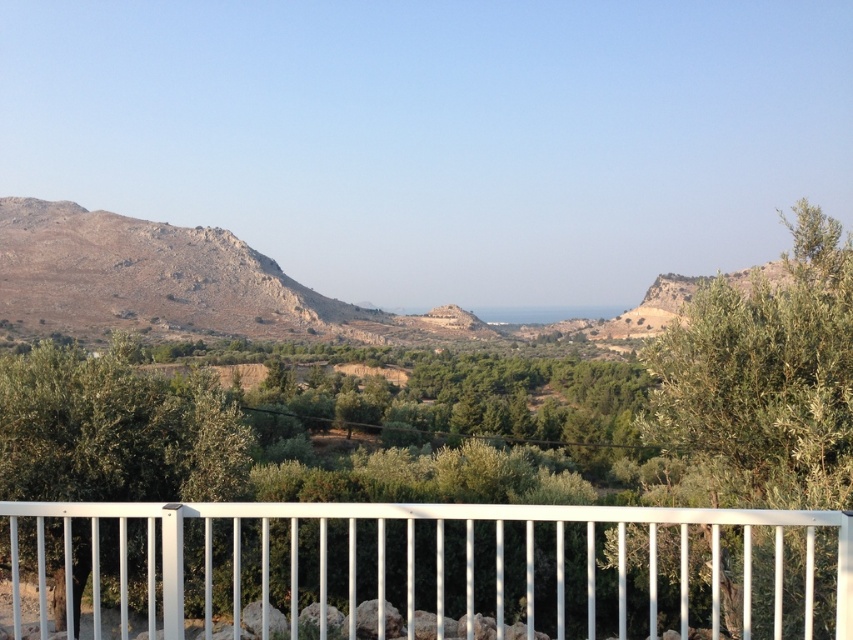
You are standing on a balcony with a white metal railing and looking out at the landscape. You notice a green leafy tree at right and a brown rocky mountain at center. Which object appears taller in the scene?

The green leafy tree at right has a lesser height compared to the brown rocky mountain at center, so the brown rocky mountain at center appears taller.

You are standing on a balcony and notice the white metal railing at lower center and the brown rocky mountain at center. Which object takes up more visual space in the scene?

The brown rocky mountain at center occupies more visual space than the white metal railing at lower center.